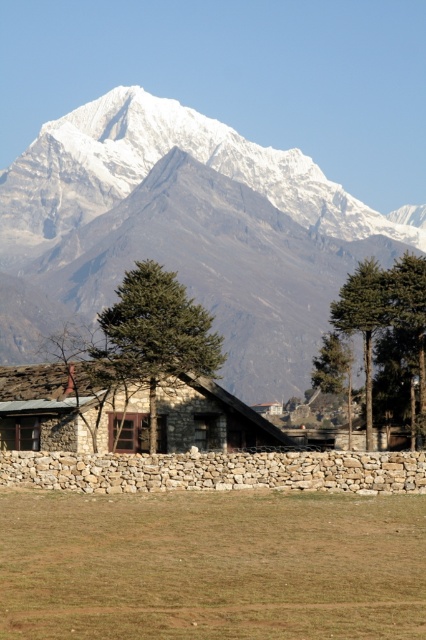
Which is more to the left, brown grass at lower center or stone textured hut at center?

Positioned to the left is stone textured hut at center.

Is brown grass at lower center further to camera compared to stone textured hut at center?

No, brown grass at lower center is in front of stone textured hut at center.

Where is `brown grass at lower center`? brown grass at lower center is located at coordinates (212, 566).

I want to click on brown grass at lower center, so click(x=212, y=566).

Who is more distant from viewer, (216, 221) or (161, 445)?

The point (216, 221) is more distant.

Between snowy granite mountain range at upper center and stone textured hut at center, which one has less height?

Standing shorter between the two is stone textured hut at center.

Between point (43, 202) and point (60, 444), which one is positioned in front?

Positioned in front is point (60, 444).

You are a GUI agent. You are given a task and a screenshot of the screen. Output one action in this format:
    pyautogui.click(x=<x>, y=<y>)
    Task: Click on the snowy granite mountain range at upper center
    
    Given the screenshot: What is the action you would take?
    pyautogui.click(x=192, y=227)

Can you confirm if snowy granite mountain range at upper center is smaller than brown grass at lower center?

Actually, snowy granite mountain range at upper center might be larger than brown grass at lower center.

Does snowy granite mountain range at upper center appear on the right side of brown grass at lower center?

Yes, snowy granite mountain range at upper center is to the right of brown grass at lower center.

Measure the distance between point (x=101, y=221) and camera.

Point (x=101, y=221) and camera are 339.83 meters apart from each other.

Locate an element on the screen. The width and height of the screenshot is (426, 640). snowy granite mountain range at upper center is located at coordinates (192, 227).